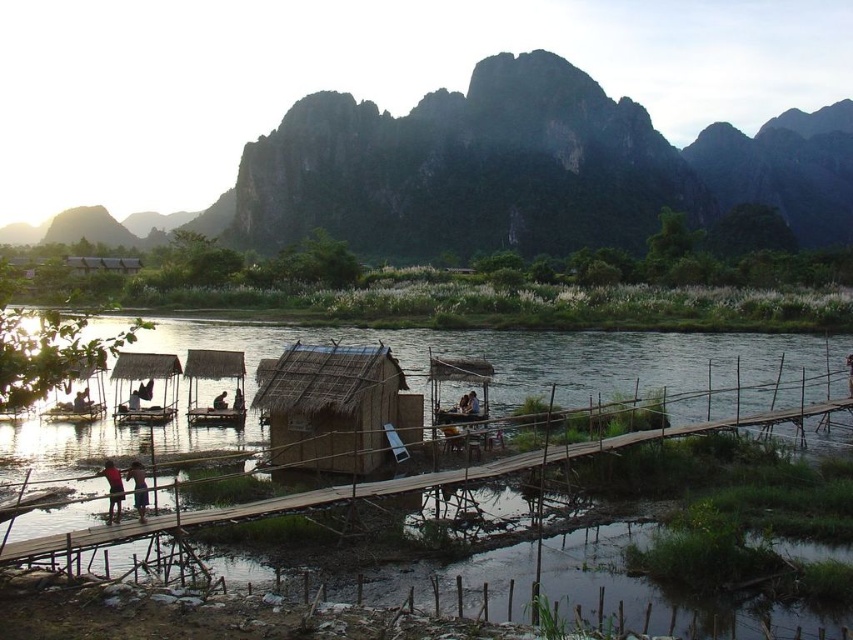
You are standing on the wooden bridge in the riverside scene. You notice two points marked on the bridge. The first point is at coordinates point (x=379, y=387) and the second is at point (x=231, y=408). Which point is nearer to you when you look straight ahead?

Point (x=379, y=387) is closer to the viewer than point (x=231, y=408).